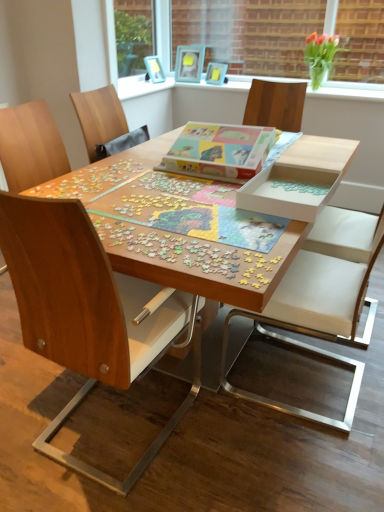
At what (x,y) coordinates should I click in order to perform the action: click on free area in between wooden chair at left, positioned as the first chair in left-to-right order, and wooden puzzle at center. Please return your answer as a coordinate pair (x, y). Looking at the image, I should click on (112, 446).